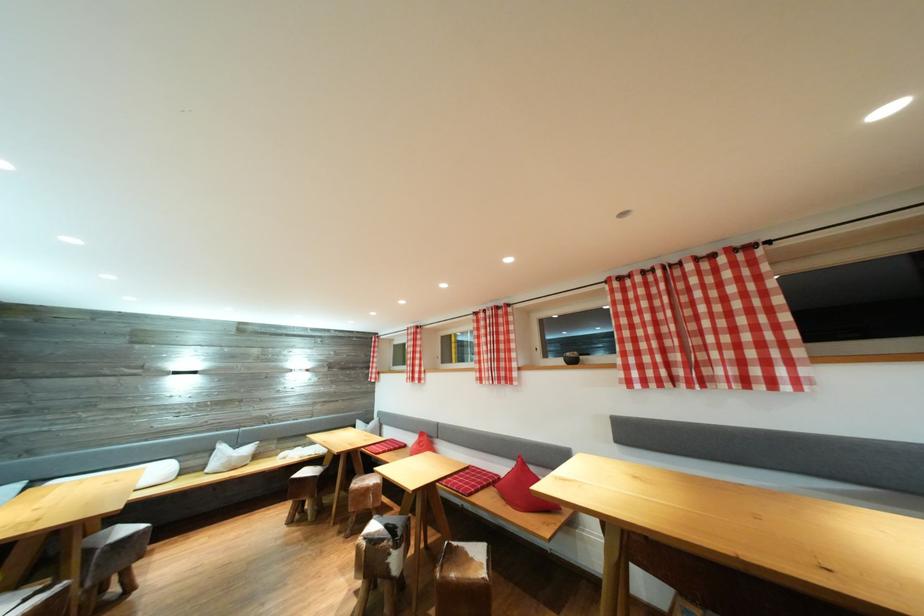
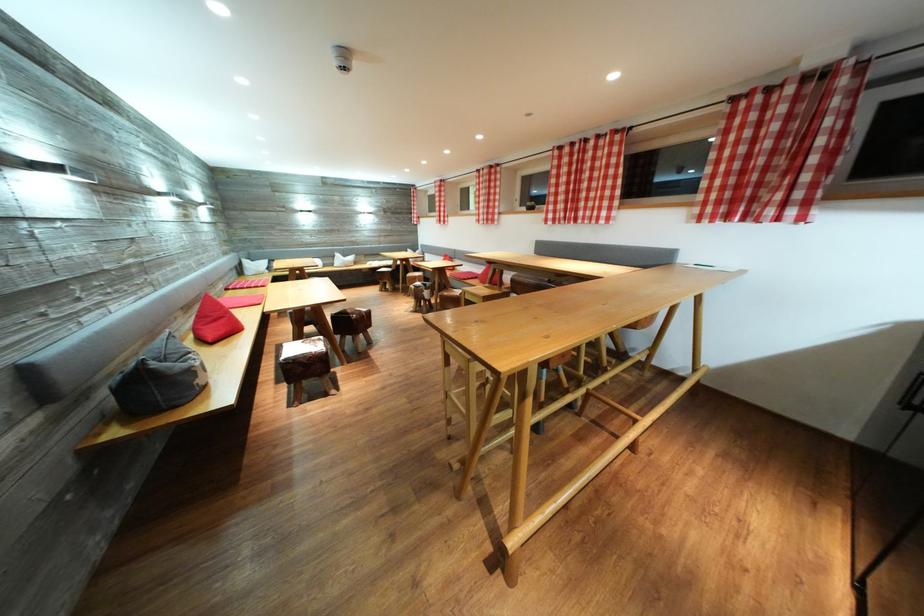
Find the pixel in the second image that matches (310,508) in the first image.

(393, 289)